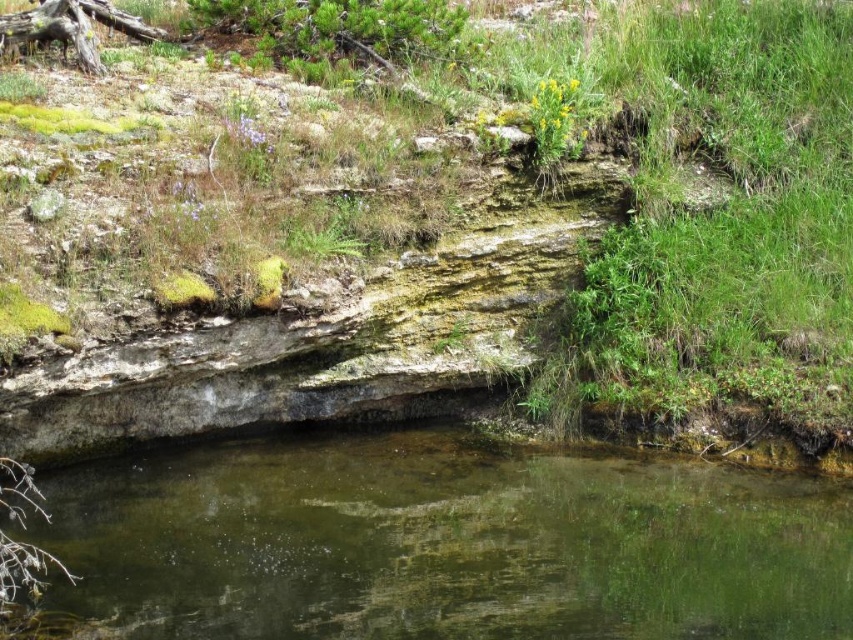
Consider the image. You are standing at the edge of the scene and want to walk from the green mossy rock at center to the clear water at bottom. Which direction should you move to reach the water?

The green mossy rock at center is to the right of clear water at bottom, so you should move to the left to reach the water.

You are planning to place a small statue on the green mossy rock at center or the clear water at bottom. Which location can accommodate the statue better based on their size?

The green mossy rock at center is larger in size than the clear water at bottom, so it can accommodate the statue better.